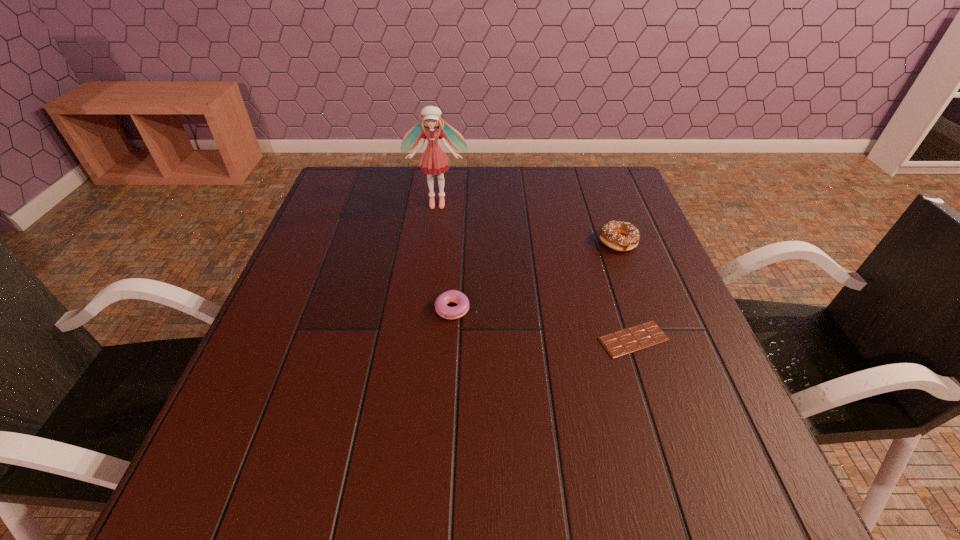
Select which object appears as the second closest to the second farthest object. Please provide its 2D coordinates. Your answer should be formatted as a tuple, i.e. [(x, y)], where the tuple contains the x and y coordinates of a point satisfying the conditions above.

[(452, 296)]

Locate an element on the screen. This screenshot has height=540, width=960. free location that satisfies the following two spatial constraints: 1. on the front-facing side of the tallest object; 2. on the right side of the chocolate bar is located at coordinates 420,339.

At what (x,y) coordinates should I click in order to perform the action: click on vacant region that satisfies the following two spatial constraints: 1. on the front-facing side of the doll; 2. on the left side of the third nearest object. Please return your answer as a coordinate pair (x, y). Looking at the image, I should click on (433, 242).

I want to click on free location that satisfies the following two spatial constraints: 1. on the front-facing side of the right doughnut; 2. on the right side of the farthest object, so click(433, 242).

The height and width of the screenshot is (540, 960). In order to click on vacant space that satisfies the following two spatial constraints: 1. on the front-facing side of the third shortest object; 2. on the right side of the doll in this screenshot , I will do `click(433, 242)`.

This screenshot has height=540, width=960. What are the coordinates of `free point that satisfies the following two spatial constraints: 1. on the front-facing side of the shortest object; 2. on the right side of the doll` in the screenshot? It's located at (420, 339).

You are a GUI agent. You are given a task and a screenshot of the screen. Output one action in this format:
    pyautogui.click(x=<x>, y=<y>)
    Task: Click on the free space that satisfies the following two spatial constraints: 1. on the front-facing side of the tallest object; 2. on the left side of the left doughnut
    
    Given the screenshot: What is the action you would take?
    pyautogui.click(x=424, y=309)

Locate an element on the screen. Image resolution: width=960 pixels, height=540 pixels. free location that satisfies the following two spatial constraints: 1. on the back side of the farther doughnut; 2. on the right side of the shortest object is located at coordinates (602, 242).